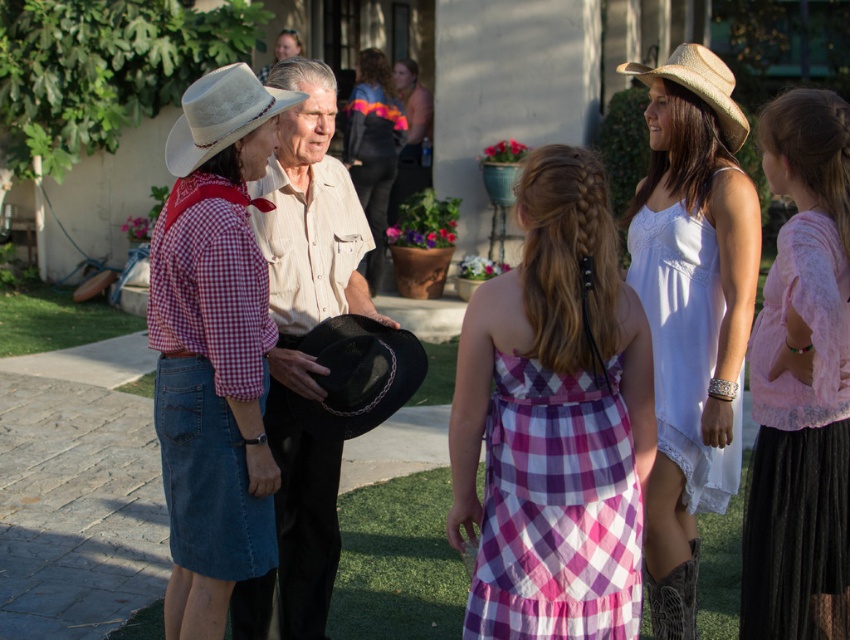
You are a photographer trying to capture a photo of the plaid cotton dress at center and the matte black cowboy hat at center. Which object should you focus on first if you want to ensure both are in frame without moving the camera?

The plaid cotton dress at center is not as tall as the matte black cowboy hat at center, so focus on the taller matte black cowboy hat at center first to ensure the entire height of both objects fits within the frame.

You are a photographer trying to capture a candid shot of the plaid cotton dress at center and the matte black cowboy hat at center. If your camera has a maximum focus range of 1.5 meters, will you be able to capture both items clearly in the same frame?

The plaid cotton dress at center is 1.38 meters from the matte black cowboy hat at center, which is within the camera maximum focus range of 1.5 meters. Therefore, both items can be captured clearly in the same frame.

You are a photographer setting up a camera to capture the scene. The plaid cotton dress at center and the matte black cowboy hat at center are both in the frame. Which object is narrower in width?

The plaid cotton dress at center is narrower in width than the matte black cowboy hat at center.